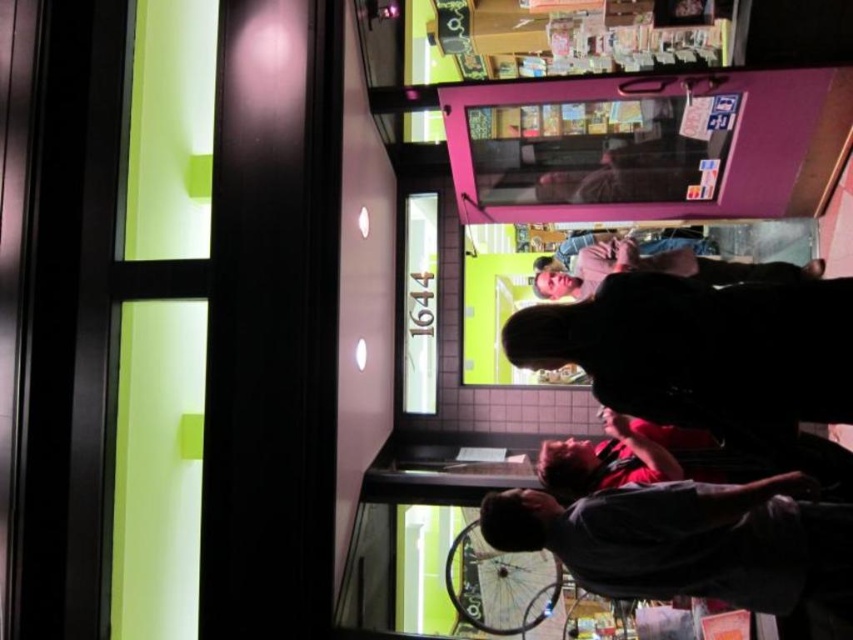
Question: Considering the real-world distances, which object is farthest from the dark matte jacket at center?

Choices:
 (A) matte pink shirt at center
 (B) dark gray shirt at lower right

Answer: (A)

Question: Is dark gray shirt at lower right bigger than matte pink shirt at center?

Choices:
 (A) yes
 (B) no

Answer: (B)

Question: Can you confirm if dark gray shirt at lower right is positioned below matte pink shirt at center?

Choices:
 (A) no
 (B) yes

Answer: (B)

Question: Which object appears closest to the camera in this image?

Choices:
 (A) dark gray shirt at lower right
 (B) matte pink shirt at center
 (C) dark matte jacket at center

Answer: (C)

Question: Is dark gray shirt at lower right closer to the viewer compared to matte pink shirt at center?

Choices:
 (A) yes
 (B) no

Answer: (A)

Question: Which of the following is the farthest from the observer?

Choices:
 (A) (816, 358)
 (B) (851, 582)

Answer: (B)